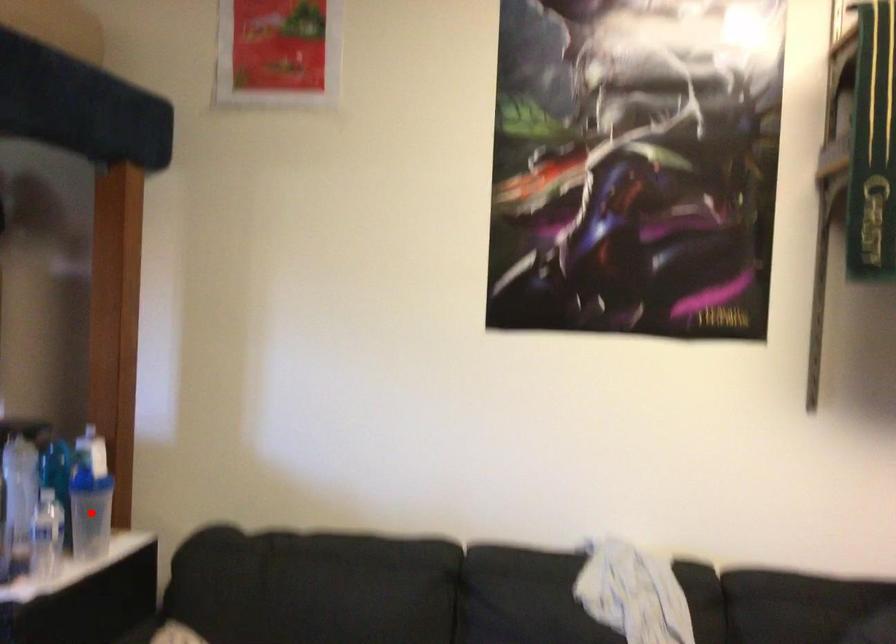
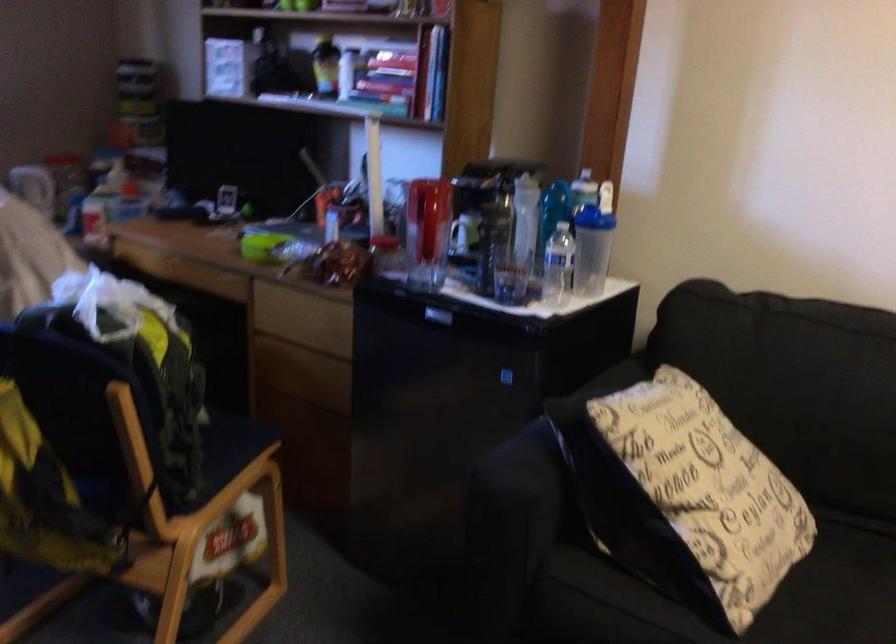
Question: I am providing you with two images of the same scene from different viewpoints. A red point is marked on the first image. Is the red point's position out of view in image 2?

Choices:
 (A) Yes
 (B) No

Answer: (B)